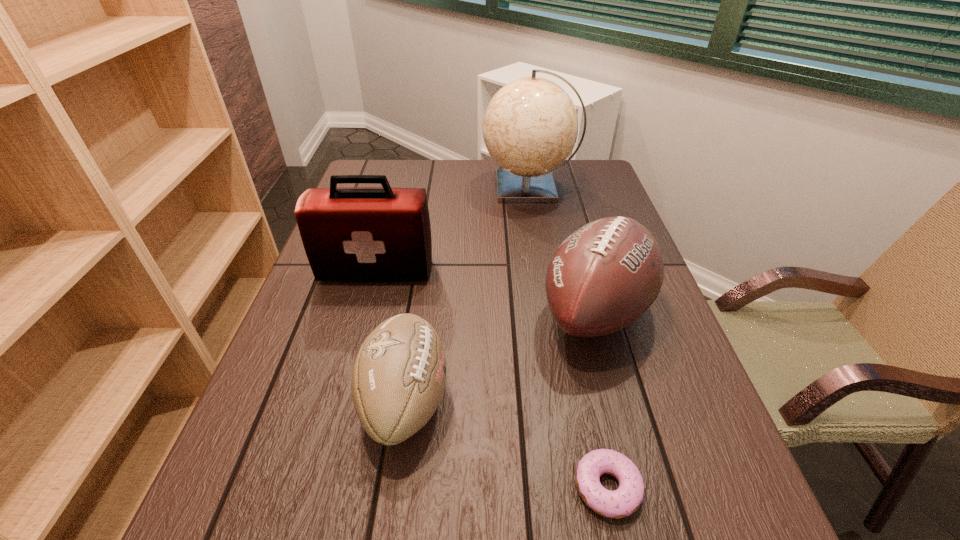
Locate an element on the screen. The width and height of the screenshot is (960, 540). vacant space that satisfies the following two spatial constraints: 1. on the surface of the right football (American) showing Europe and Africa; 2. on the left side of the farthest object is located at coordinates (550, 312).

Locate an element on the screen. vacant space that satisfies the following two spatial constraints: 1. on the surface of the shortest object showing Europe and Africa; 2. on the right side of the farthest object is located at coordinates (579, 487).

Where is `free space that satisfies the following two spatial constraints: 1. on the side of the doughnut with the cross symbol; 2. on the right side of the first aid kit`? The height and width of the screenshot is (540, 960). free space that satisfies the following two spatial constraints: 1. on the side of the doughnut with the cross symbol; 2. on the right side of the first aid kit is located at coordinates (318, 487).

Where is `vacant area in the image that satisfies the following two spatial constraints: 1. on the surface of the tallest object showing Europe and Africa; 2. on the side of the first aid kit with the cross symbol`? vacant area in the image that satisfies the following two spatial constraints: 1. on the surface of the tallest object showing Europe and Africa; 2. on the side of the first aid kit with the cross symbol is located at coordinates (543, 272).